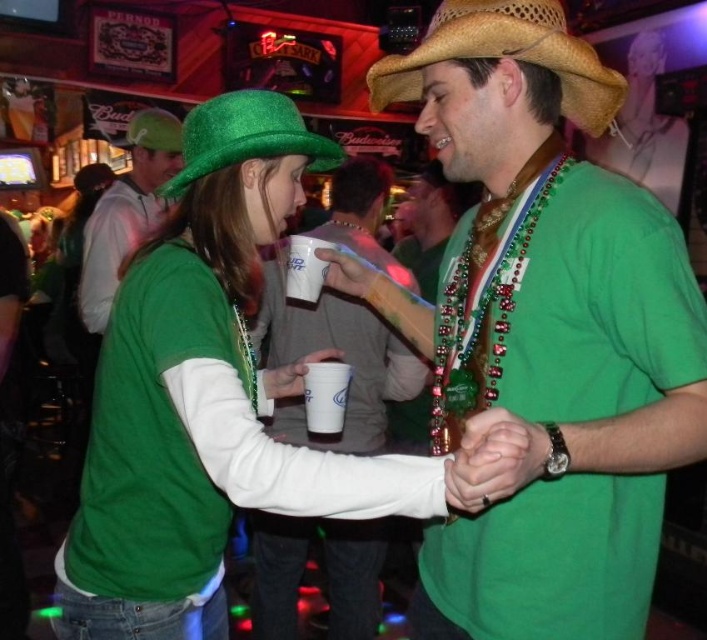
You are at a party and want to grab the white paper cup at center without touching the matte green shirt at center. Is this possible?

The matte green shirt at center is located above the white paper cup at center, so you can reach down to grab the white paper cup at center without touching the matte green shirt at center.